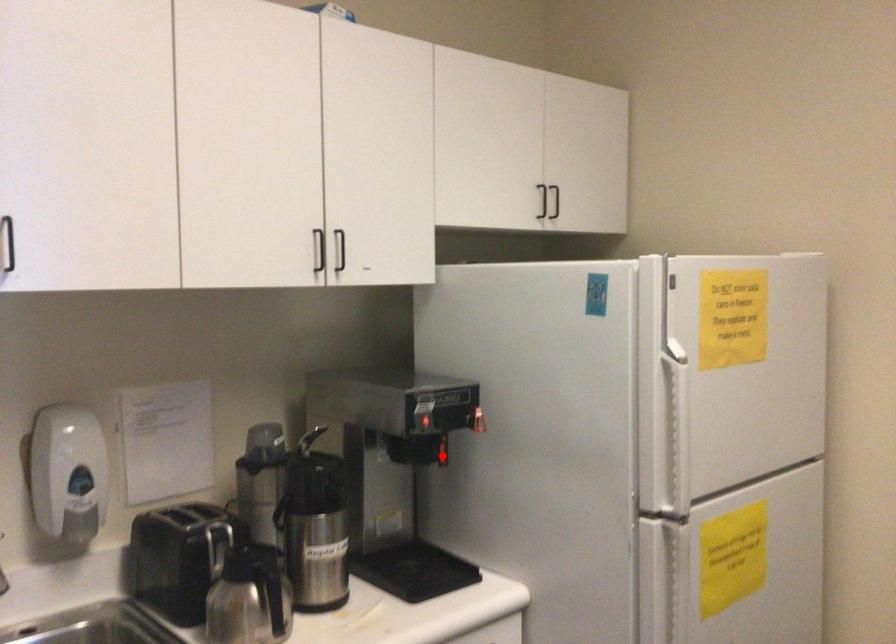
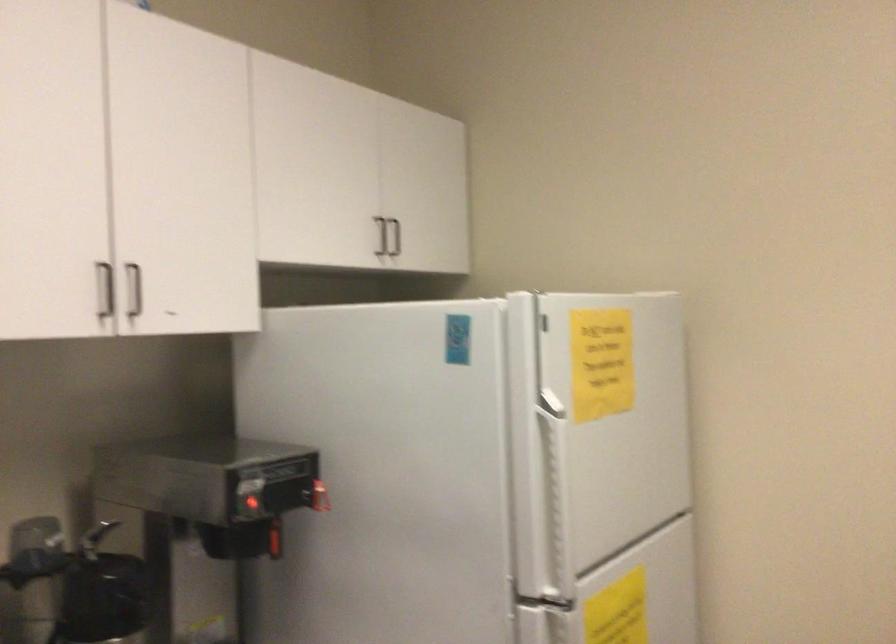
Where in the second image is the point corresponding to the highlighted location from the first image?

(273, 541)